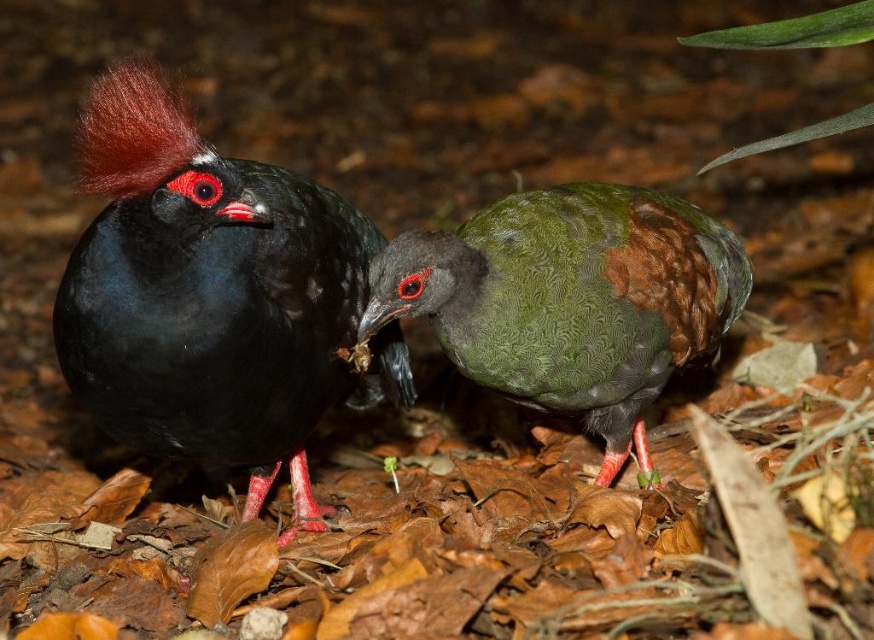
At what (x,y) coordinates should I click in order to perform the action: click on shiny black bird at left. Please return your answer as a coordinate pair (x, y). Looking at the image, I should click on (207, 294).

Describe the element at coordinates (207, 294) in the screenshot. I see `shiny black bird at left` at that location.

Where is `shiny black bird at left`? Image resolution: width=874 pixels, height=640 pixels. shiny black bird at left is located at coordinates (207, 294).